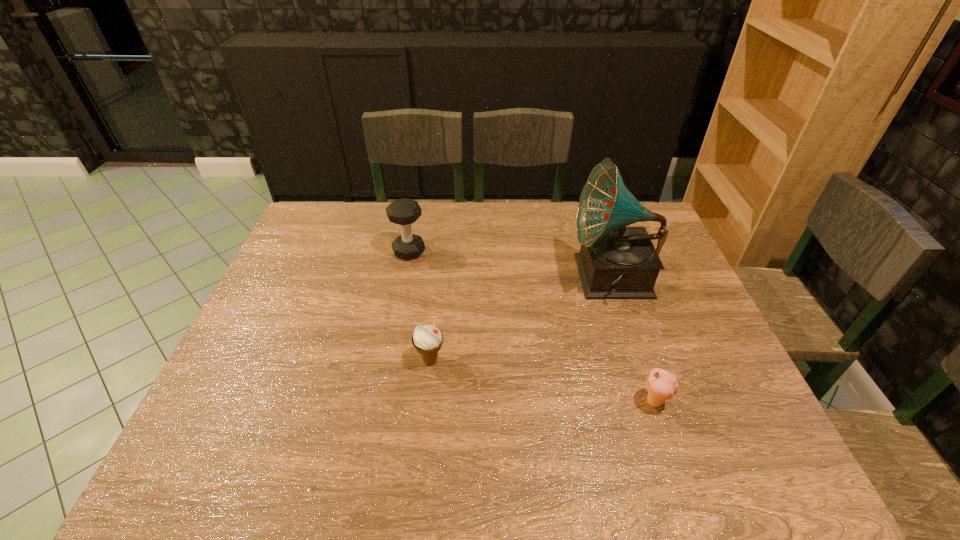
At what (x,y) coordinates should I click in order to perform the action: click on the tallest object. Please return your answer as a coordinate pair (x, y). Looking at the image, I should click on (615, 262).

The width and height of the screenshot is (960, 540). I want to click on dumbbell, so click(x=404, y=212).

You are a GUI agent. You are given a task and a screenshot of the screen. Output one action in this format:
    pyautogui.click(x=<x>, y=<y>)
    Task: Click on the leftmost object
    This screenshot has height=540, width=960.
    Given the screenshot: What is the action you would take?
    pyautogui.click(x=404, y=212)

Where is `the farther icecream`? The height and width of the screenshot is (540, 960). the farther icecream is located at coordinates (427, 340).

Locate an element on the screen. This screenshot has height=540, width=960. the second nearest object is located at coordinates (427, 340).

Image resolution: width=960 pixels, height=540 pixels. Find the location of `the right icecream`. the right icecream is located at coordinates (662, 385).

Locate an element on the screen. The height and width of the screenshot is (540, 960). the nearest object is located at coordinates (662, 385).

You are a GUI agent. You are given a task and a screenshot of the screen. Output one action in this format:
    pyautogui.click(x=<x>, y=<y>)
    Task: Click on the vacant space located 0.060m on the horn of the tallest object
    
    Given the screenshot: What is the action you would take?
    pyautogui.click(x=550, y=279)

The image size is (960, 540). Find the location of `free space located on the horn of the tallest object`. free space located on the horn of the tallest object is located at coordinates (530, 279).

You are a GUI agent. You are given a task and a screenshot of the screen. Output one action in this format:
    pyautogui.click(x=<x>, y=<y>)
    Task: Click on the vacant region located 0.300m on the horn of the tallest object
    This screenshot has height=540, width=960.
    Given the screenshot: What is the action you would take?
    pyautogui.click(x=469, y=279)